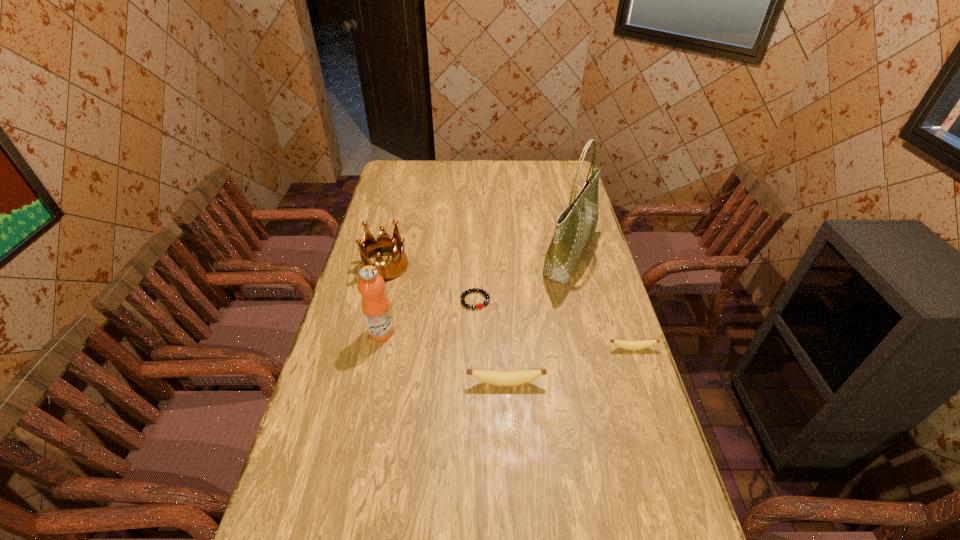
Image resolution: width=960 pixels, height=540 pixels. I want to click on free space between the left banana and the bracelet, so click(491, 342).

Identify the location of vacant area that lies between the fifth shortest object and the bracelet. (428, 316).

Find the location of a particular element. The height and width of the screenshot is (540, 960). free space between the tallest object and the third nearest object is located at coordinates (475, 294).

The image size is (960, 540). What are the coordinates of `vacant space in between the crown and the left banana` in the screenshot? It's located at (445, 325).

Locate an element on the screen. empty space between the fourth nearest object and the fruit juice is located at coordinates (428, 316).

Find the location of a particular element. This screenshot has width=960, height=540. object that is the fifth closest to the nearest object is located at coordinates (368, 247).

Where is `object identified as the fourth closest to the fifth shortest object`? object identified as the fourth closest to the fifth shortest object is located at coordinates (575, 227).

Where is `vacant space that satisfies the following two spatial constraints: 1. on the front side of the fruit juice; 2. on the left side of the third tallest object`? vacant space that satisfies the following two spatial constraints: 1. on the front side of the fruit juice; 2. on the left side of the third tallest object is located at coordinates (369, 332).